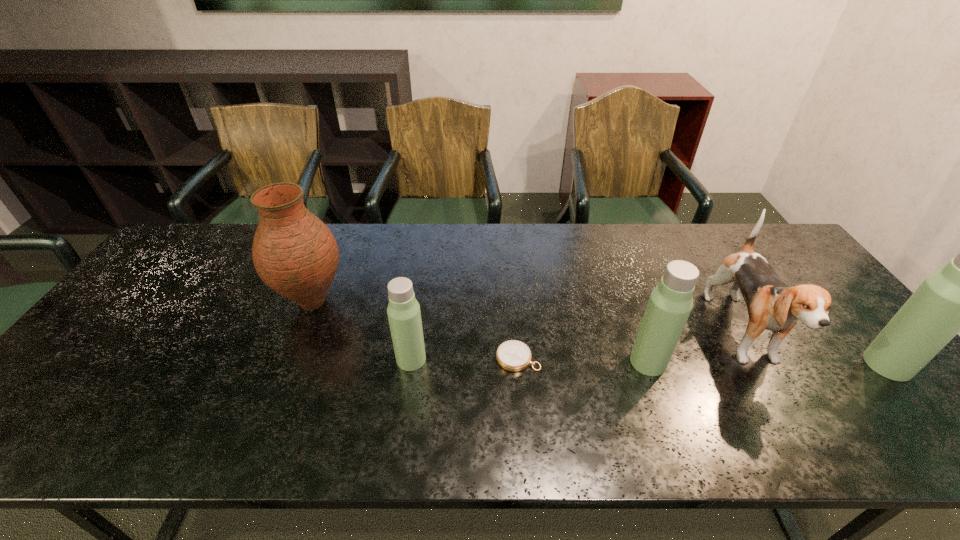
The width and height of the screenshot is (960, 540). Find the location of `free spot between the second object from right to left and the compass`. free spot between the second object from right to left and the compass is located at coordinates (631, 347).

This screenshot has height=540, width=960. Find the location of `vacant area that lies between the fourth object from right to left and the rightmost object`. vacant area that lies between the fourth object from right to left and the rightmost object is located at coordinates (703, 361).

Locate an element on the screen. This screenshot has height=540, width=960. object that can be found as the third closest to the vase is located at coordinates (671, 301).

I want to click on object that stands as the second closest to the vase, so click(x=513, y=355).

Select which thermos bottle appears as the second closest to the second object from right to left. Please provide its 2D coordinates. Your answer should be formatted as a tuple, i.e. [(x, y)], where the tuple contains the x and y coordinates of a point satisfying the conditions above.

[(959, 297)]

Locate which thermos bottle ranks third in proximity to the leftmost object. Please provide its 2D coordinates. Your answer should be formatted as a tuple, i.e. [(x, y)], where the tuple contains the x and y coordinates of a point satisfying the conditions above.

[(959, 297)]

Where is `vacant space that satisfies the following two spatial constraints: 1. on the front side of the third object from right to left; 2. on the left side of the rightmost object`? The width and height of the screenshot is (960, 540). vacant space that satisfies the following two spatial constraints: 1. on the front side of the third object from right to left; 2. on the left side of the rightmost object is located at coordinates (649, 364).

Where is `vacant area that satisfies the following two spatial constraints: 1. on the front side of the fourth object from left to right; 2. on the left side of the compass`? The image size is (960, 540). vacant area that satisfies the following two spatial constraints: 1. on the front side of the fourth object from left to right; 2. on the left side of the compass is located at coordinates (518, 362).

Find the location of a particular element. This screenshot has height=540, width=960. free point that satisfies the following two spatial constraints: 1. on the front side of the second thermos bottle from left to right; 2. on the right side of the vase is located at coordinates (288, 362).